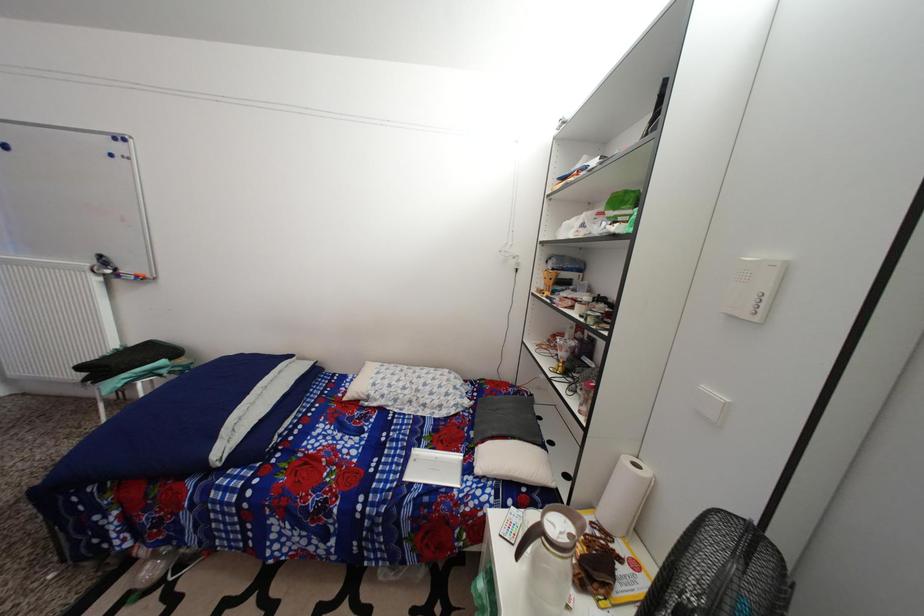
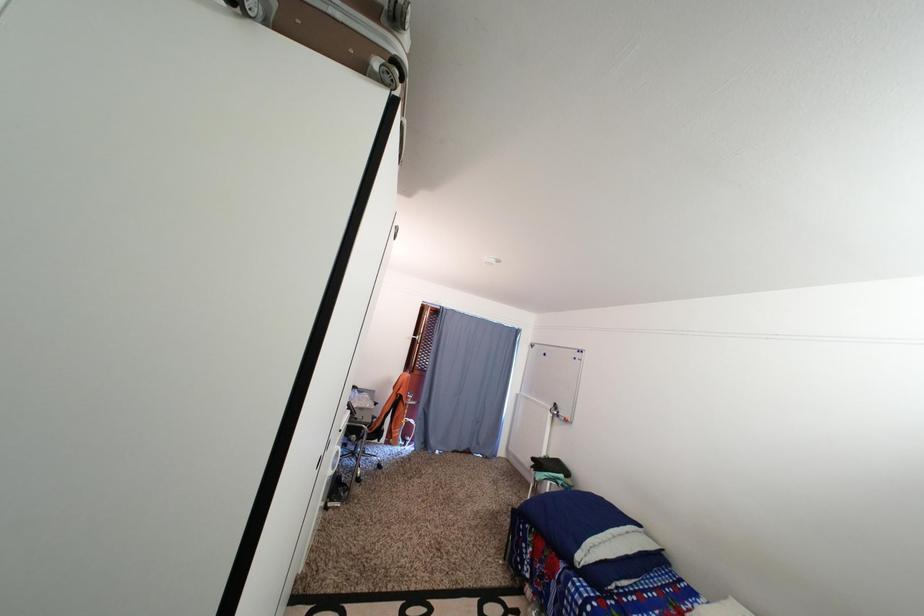
Based on the continuous images, in which direction is the camera rotating?

The camera rotated toward left-up.